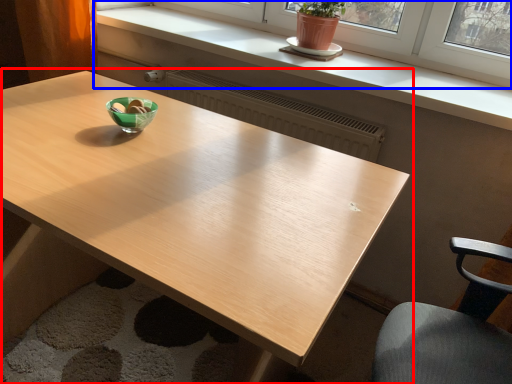
Question: Which of the following is the closest to the observer, table (highlighted by a red box) or window (highlighted by a blue box)?

Choices:
 (A) table
 (B) window

Answer: (A)